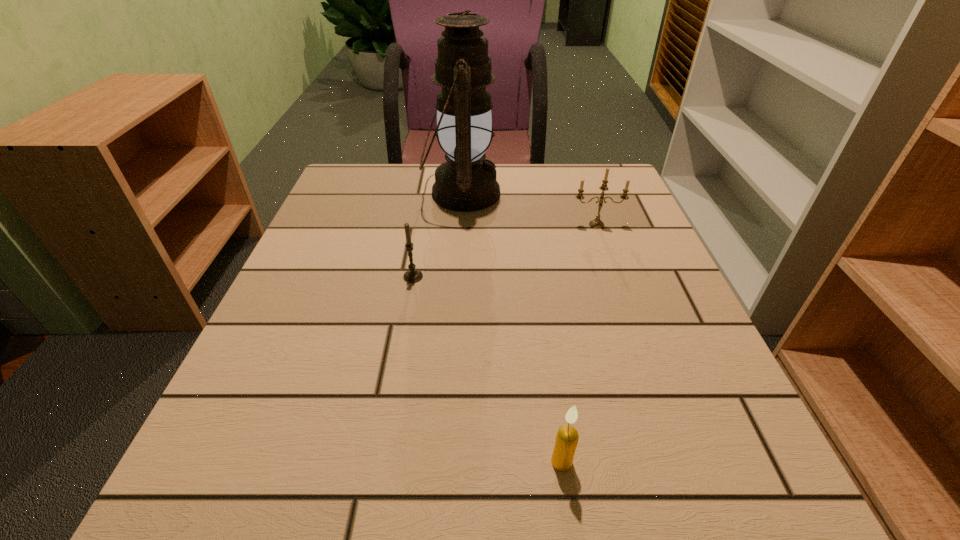
Find the location of `vacant position located on the right of the second nearest candle`. vacant position located on the right of the second nearest candle is located at coordinates (605, 276).

Locate an element on the screen. This screenshot has height=540, width=960. object at the far edge is located at coordinates (x=466, y=182).

I want to click on object that is at the near edge, so click(567, 436).

Image resolution: width=960 pixels, height=540 pixels. Find the location of `object that is at the right edge`. object that is at the right edge is located at coordinates (596, 223).

Identify the location of vacant region at the far edge of the desktop. [525, 167].

Locate an element on the screen. The height and width of the screenshot is (540, 960). blank space at the near edge of the desktop is located at coordinates (368, 464).

Image resolution: width=960 pixels, height=540 pixels. In the image, there is a desktop. What are the coordinates of `vacant space at the left edge` in the screenshot? It's located at (367, 239).

Where is `vacant space at the right edge of the desktop`? The image size is (960, 540). vacant space at the right edge of the desktop is located at coordinates (610, 320).

Locate an element on the screen. The width and height of the screenshot is (960, 540). vacant space at the far left corner of the desktop is located at coordinates (347, 174).

You are a GUI agent. You are given a task and a screenshot of the screen. Output one action in this format:
    pyautogui.click(x=<x>, y=<y>)
    Task: Click on the vacant space at the near left corner of the desktop
    
    Given the screenshot: What is the action you would take?
    pyautogui.click(x=232, y=497)